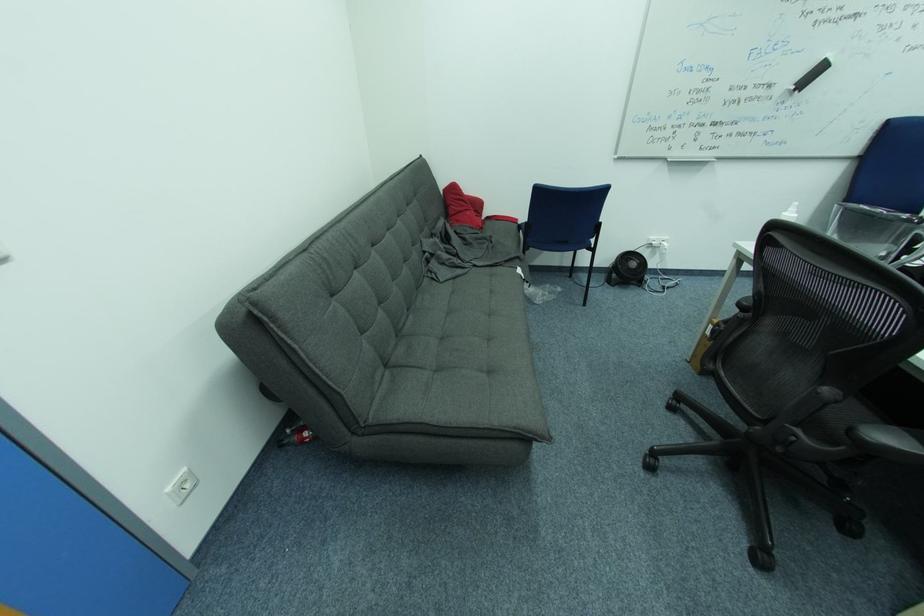
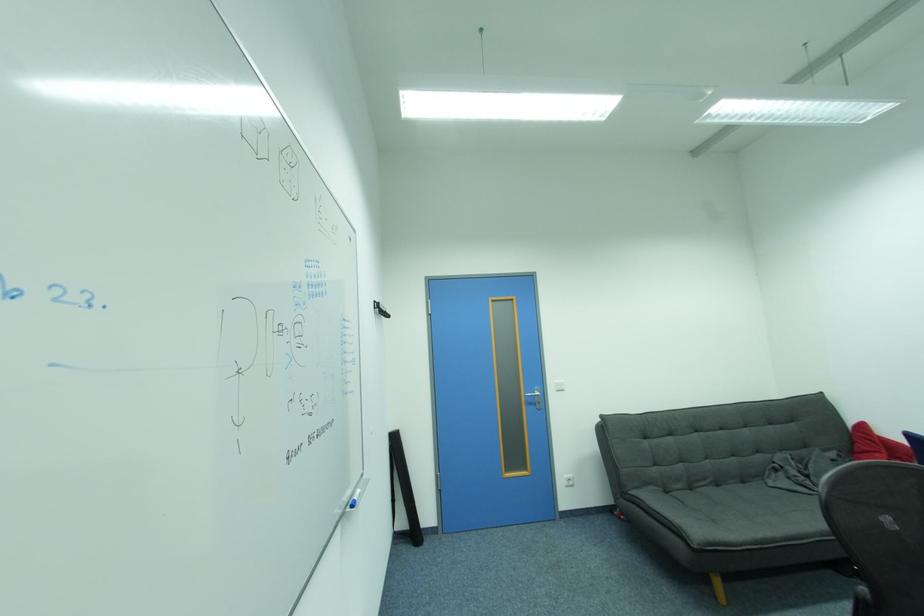
Find the pixel in the second image that matches point (415, 312) in the first image.

(723, 487)